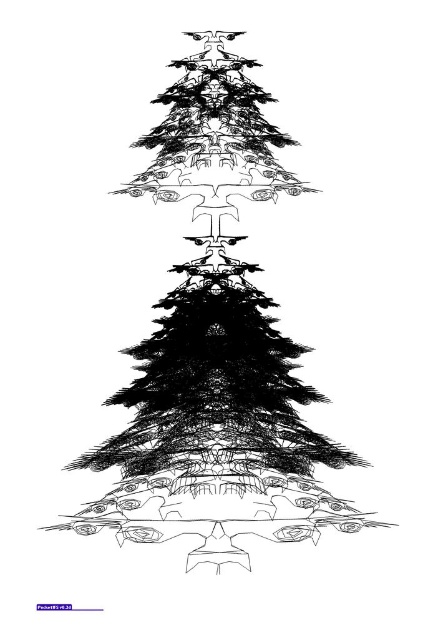
Does point (211, 458) come in front of point (279, 484)?

No, (211, 458) is behind (279, 484).

Which of these two, black ink drawing of christmas tree at center or smooth textured base at center, stands shorter?

smooth textured base at center is shorter.

Image resolution: width=428 pixels, height=640 pixels. Identify the location of black ink drawing of christmas tree at center. (216, 344).

You are a GUI agent. You are given a task and a screenshot of the screen. Output one action in this format:
    pyautogui.click(x=<x>, y=<y>)
    Task: Click on the black ink drawing of christmas tree at center
    The image size is (428, 640).
    Given the screenshot: What is the action you would take?
    pyautogui.click(x=216, y=344)